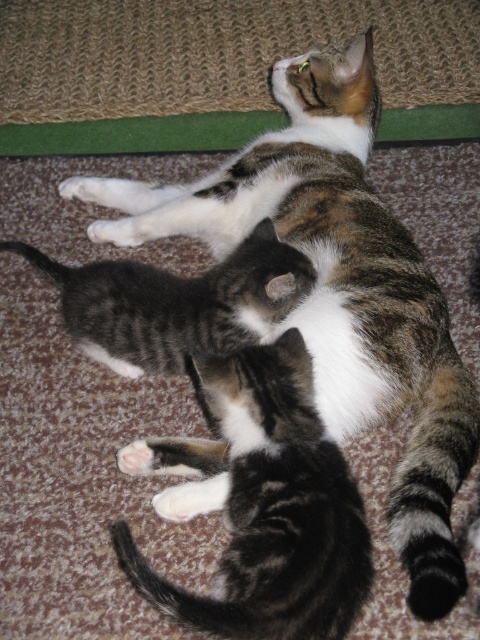
What do you see at coordinates (266, 506) in the screenshot? Image resolution: width=480 pixels, height=640 pixels. I see `striped fur kitten at center` at bounding box center [266, 506].

Between point (250, 394) and point (206, 296), which one is positioned behind?

The point (206, 296) is behind.

Identify the location of striped fur kitten at center. This screenshot has width=480, height=640. (266, 506).